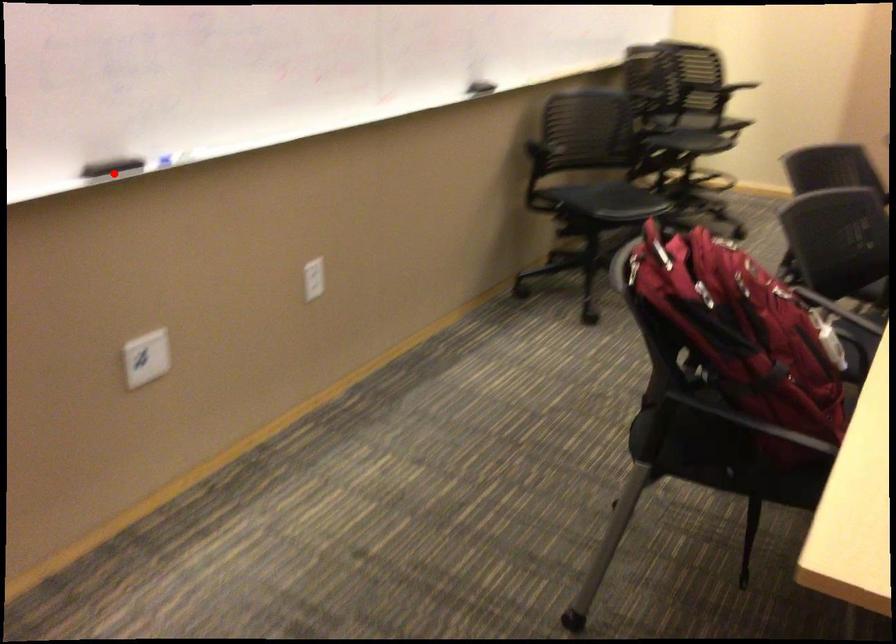
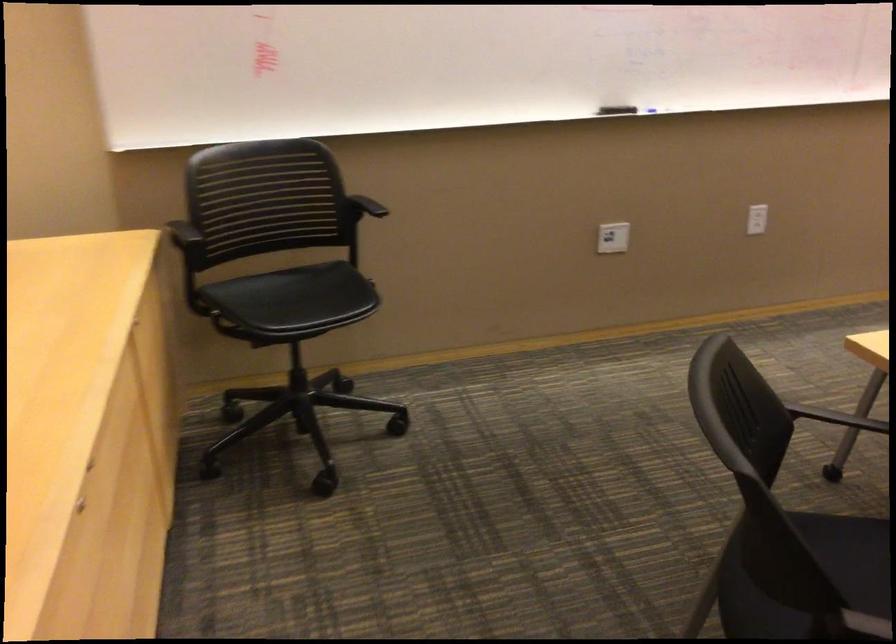
Question: I am providing you with two images of the same scene from different viewpoints. Image1 has a red point marked. In image2, the corresponding 3D location appears at what relative position? Reply with the corresponding letter.

Choices:
 (A) Closer
 (B) Farther

Answer: (B)